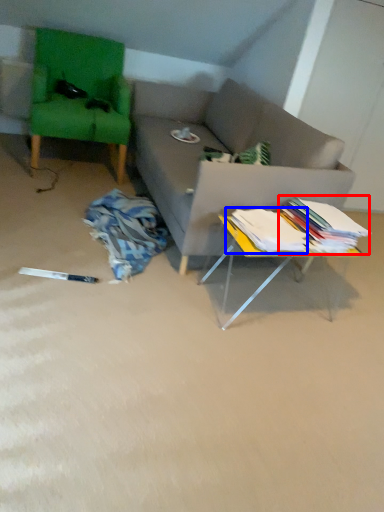
Question: Among these objects, which one is nearest to the camera, book (highlighted by a red box) or book (highlighted by a blue box)?

Choices:
 (A) book
 (B) book

Answer: (B)